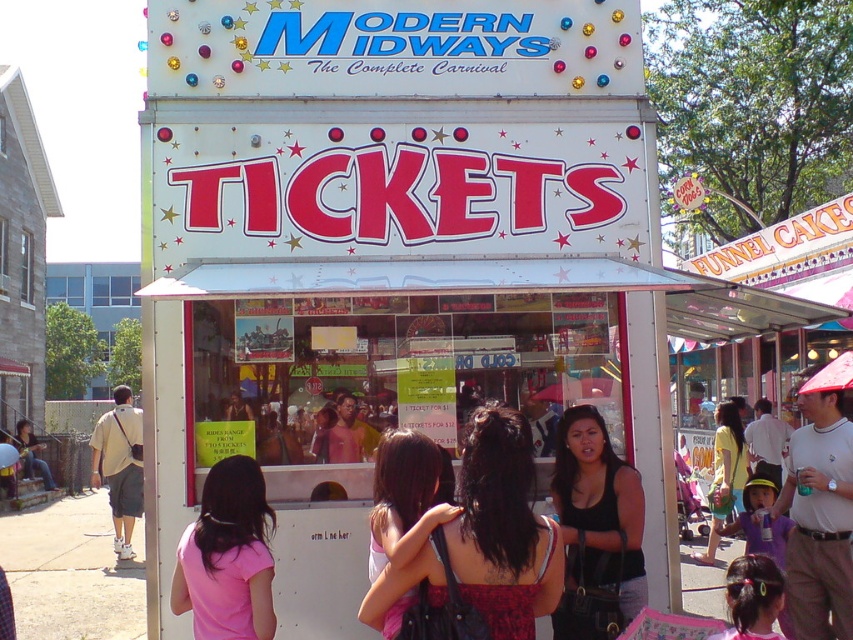
Question: Is pink matte shirt at lower left wider than matte pink shirt at center?

Choices:
 (A) no
 (B) yes

Answer: (B)

Question: Which point is closer to the camera?

Choices:
 (A) matte black hair at center
 (B) white plastic umbrella at upper right

Answer: (A)

Question: Can you confirm if black matte tank top at center is positioned to the left of pink fabric hair at center?

Choices:
 (A) no
 (B) yes

Answer: (B)

Question: Is black matte tank top at center bigger than pink fabric hair at center?

Choices:
 (A) yes
 (B) no

Answer: (A)

Question: Estimate the real-world distances between objects in this image. Which object is closer to the pink matte shirt at lower left?

Choices:
 (A) black matte tank top at center
 (B) matte pink shirt at center

Answer: (B)

Question: Which is nearer to the white plastic umbrella at upper right?

Choices:
 (A) matte black hair at center
 (B) matte pink shirt at center

Answer: (B)